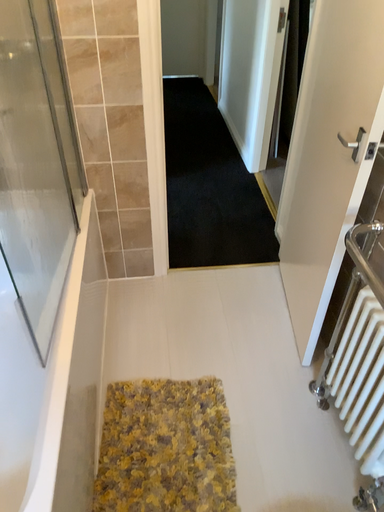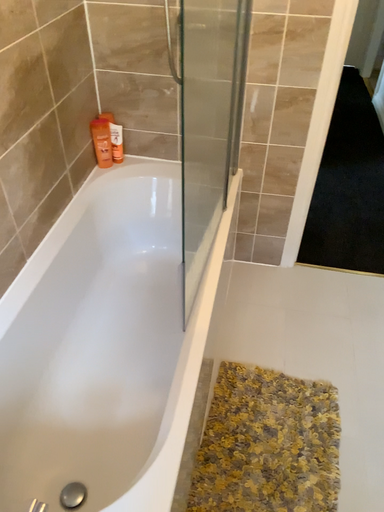
Question: How did the camera likely rotate when shooting the video?

Choices:
 (A) rotated right
 (B) rotated left

Answer: (B)